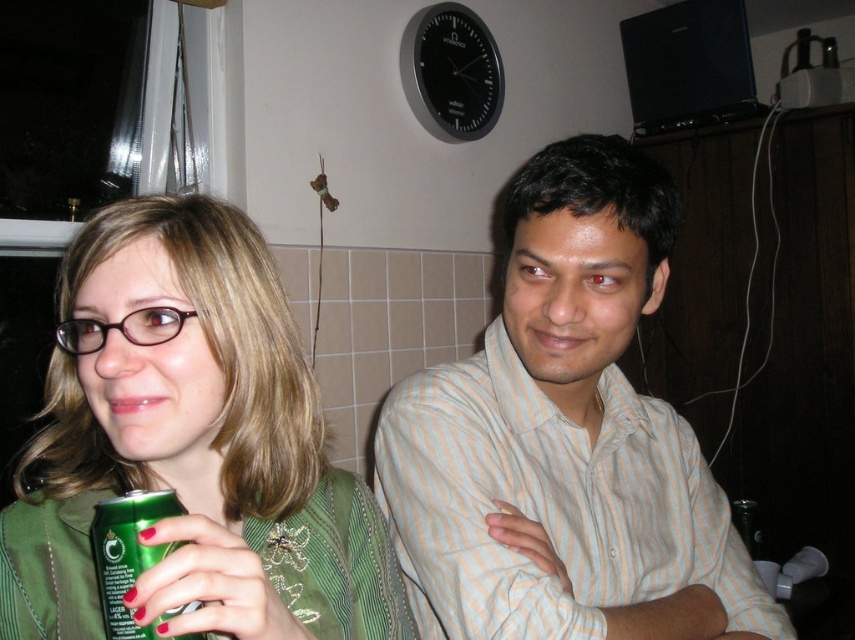
Question: Which of the following is the farthest from the observer?

Choices:
 (A) green matte can at left
 (B) green metallic can at lower left

Answer: (B)

Question: Among these points, which one is nearest to the camera?

Choices:
 (A) (81, 612)
 (B) (494, 492)
 (C) (116, 595)

Answer: (C)

Question: Does green matte can at left have a greater width compared to green metallic can at lower left?

Choices:
 (A) no
 (B) yes

Answer: (B)

Question: In this image, where is green matte can at left located relative to green metallic can at lower left?

Choices:
 (A) above
 (B) below

Answer: (A)

Question: Is light beige striped shirt at center further to camera compared to green matte can at left?

Choices:
 (A) yes
 (B) no

Answer: (A)

Question: Which object is positioned closest to the green metallic can at lower left?

Choices:
 (A) green matte can at left
 (B) light beige striped shirt at center

Answer: (A)